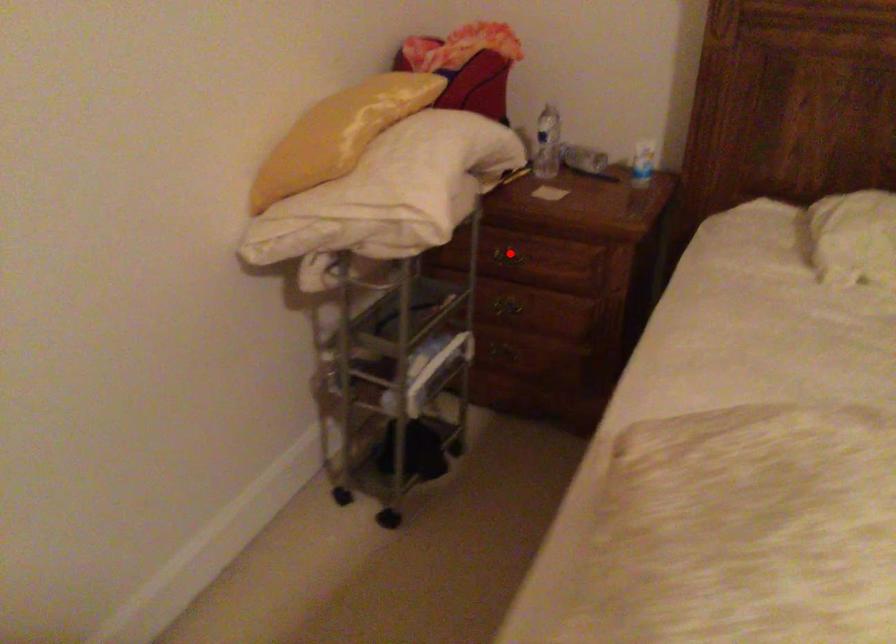
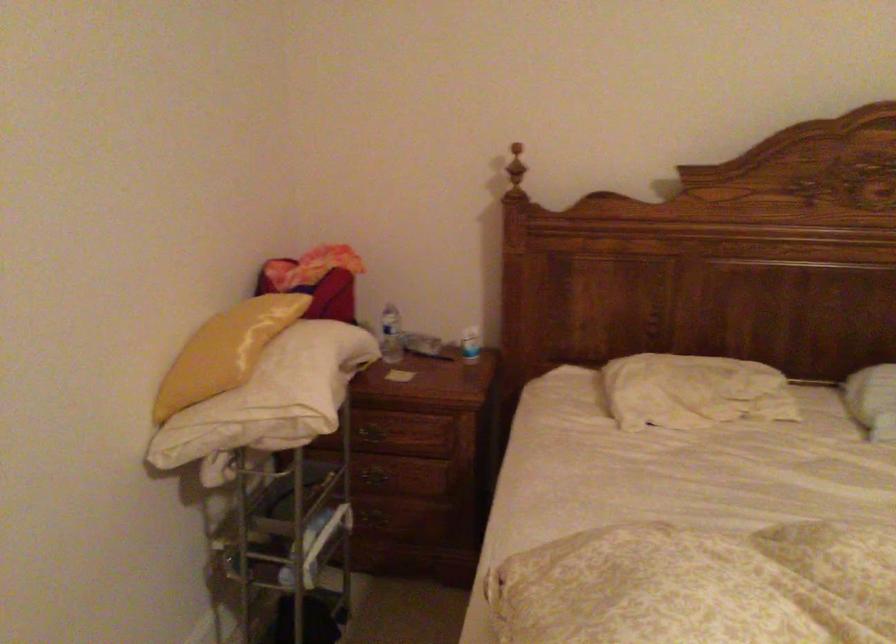
Question: I am providing you with two images of the same scene from different viewpoints. A red point is marked on the first image. Is the red point's position out of view in image 2?

Choices:
 (A) Yes
 (B) No

Answer: (B)